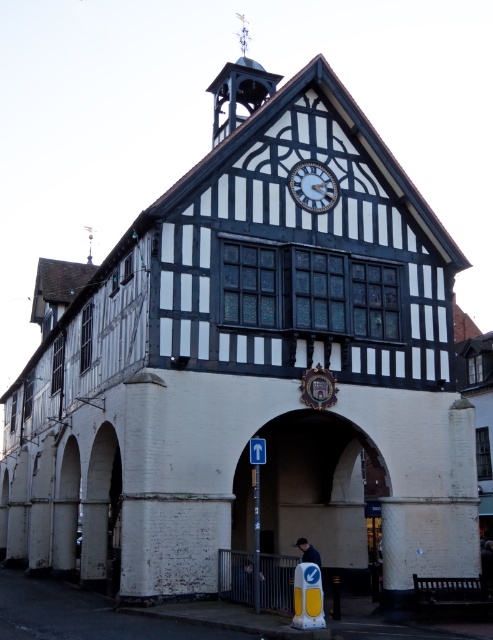
Question: Where is white brick archway at center located in relation to dark blue fabric jacket at lower center in the image?

Choices:
 (A) below
 (B) above

Answer: (A)

Question: Does polished brass bell tower at upper center appear on the left side of white glossy clock at upper center?

Choices:
 (A) yes
 (B) no

Answer: (A)

Question: Which object appears farthest from the camera in this image?

Choices:
 (A) polished brass bell tower at upper center
 (B) white glossy clock at upper center
 (C) dark blue fabric jacket at lower center

Answer: (A)

Question: Which point appears farthest from the camera in this image?

Choices:
 (A) (308, 545)
 (B) (244, 116)
 (C) (337, 189)
 (D) (234, 529)

Answer: (B)

Question: Is polished brass bell tower at upper center above white glossy clock at upper center?

Choices:
 (A) no
 (B) yes

Answer: (B)

Question: Estimate the real-world distances between objects in this image. Which object is farther from the white glossy clock at upper center?

Choices:
 (A) polished brass bell tower at upper center
 (B) white brick archway at center
 (C) dark blue fabric jacket at lower center

Answer: (C)